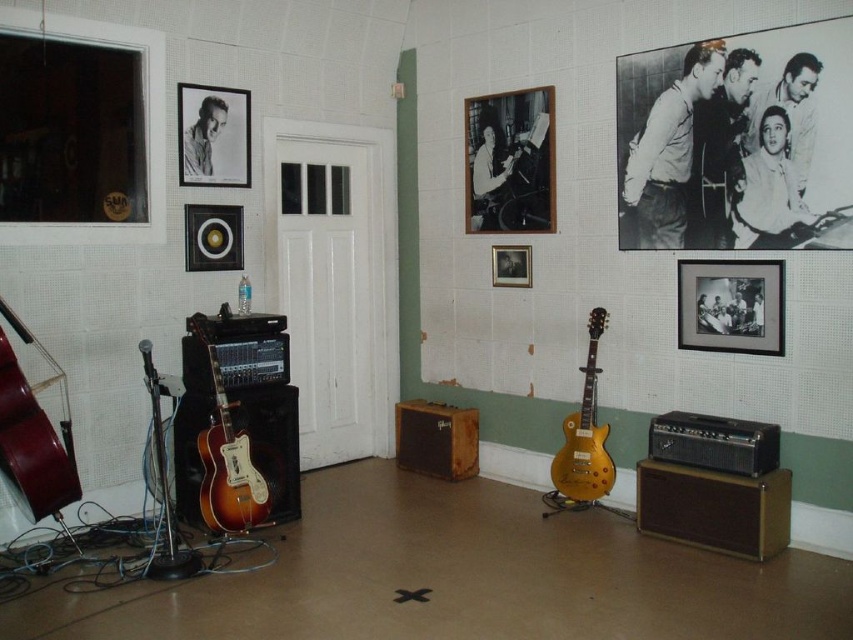
Between black matte picture frame at center right and mahogany wood cello at left, which one is positioned higher?

black matte picture frame at center right is above.

Measure the distance from black matte picture frame at center right to mahogany wood cello at left.

3.31 meters

Where is `black matte picture frame at center right`? black matte picture frame at center right is located at coordinates (730, 305).

At what (x,y) coordinates should I click in order to perform the action: click on black matte picture frame at center right. Please return your answer as a coordinate pair (x, y). The width and height of the screenshot is (853, 640). Looking at the image, I should click on (730, 305).

Measure the distance between sunburst wood electric guitar at center and camera.

sunburst wood electric guitar at center and camera are 3.58 meters apart from each other.

Which is more to the left, sunburst wood electric guitar at center or black glossy picture frame at center?

sunburst wood electric guitar at center is more to the left.

Locate an element on the screen. The height and width of the screenshot is (640, 853). sunburst wood electric guitar at center is located at coordinates (227, 461).

Locate an element on the screen. This screenshot has height=640, width=853. sunburst wood electric guitar at center is located at coordinates (227, 461).

Who is lower down, wooden framed photograph at center or black matte picture frame at upper left?

Positioned lower is wooden framed photograph at center.

Who is positioned more to the left, wooden framed photograph at center or black matte picture frame at upper left?

black matte picture frame at upper left is more to the left.

Who is more forward, (479, 152) or (195, 108)?

Positioned in front is point (195, 108).

Locate an element on the screen. This screenshot has height=640, width=853. wooden framed photograph at center is located at coordinates tap(509, 161).